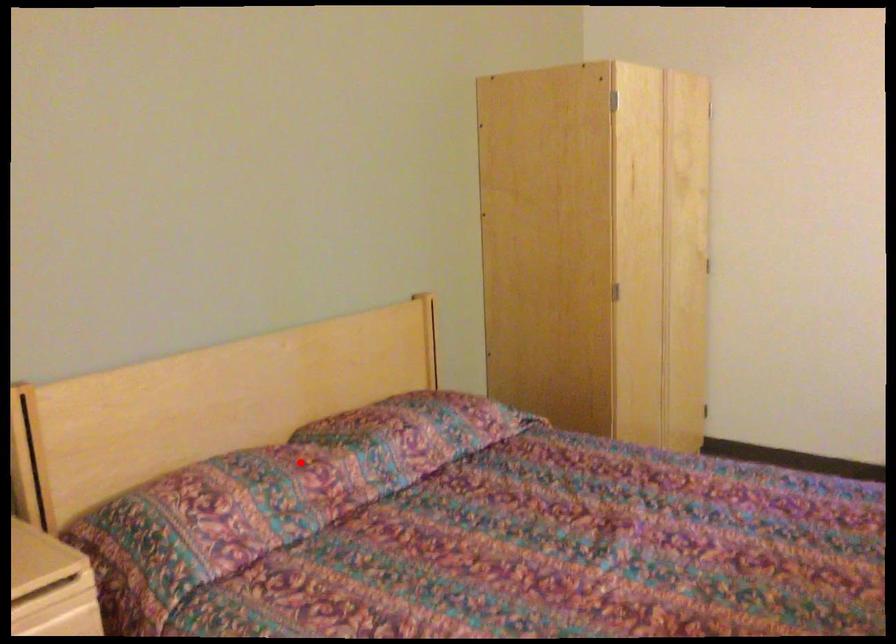
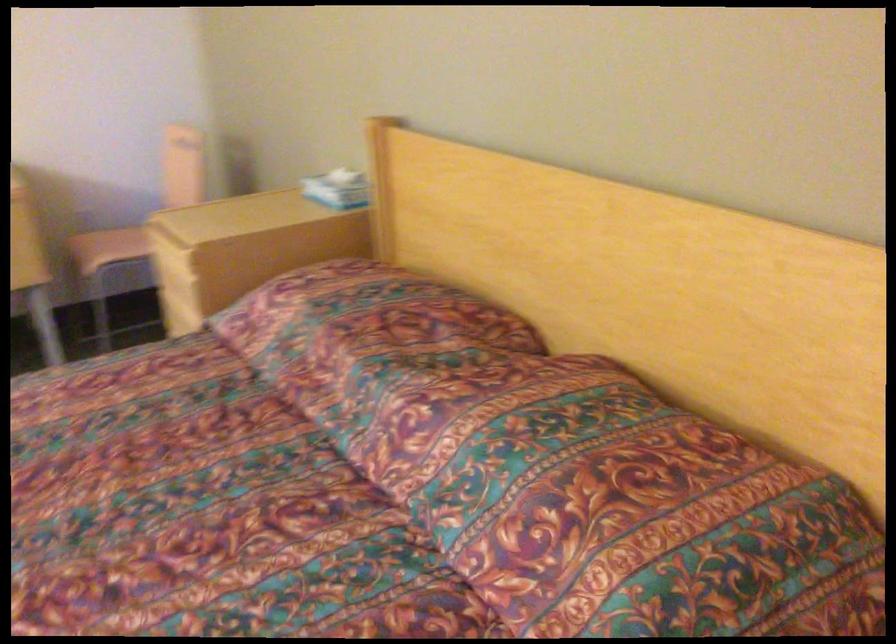
In the second image, find the point that corresponds to the highlighted location in the first image.

(354, 325)